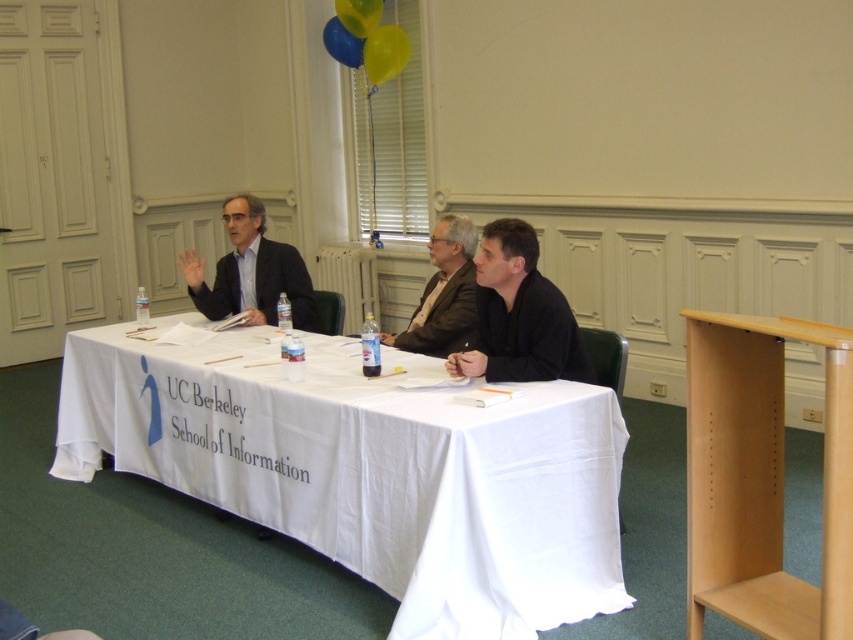
Question: Can you confirm if rubber yellow balloon at upper center is bigger than yellow rubber balloon at upper center?

Choices:
 (A) yes
 (B) no

Answer: (A)

Question: Which of the following is the closest to the observer?

Choices:
 (A) (358, 26)
 (B) (399, 486)

Answer: (B)

Question: Is matte black shirt at center wider than dark brown leather jacket at center?

Choices:
 (A) no
 (B) yes

Answer: (B)

Question: Based on their relative distances, which object is nearer to the yellow rubber balloon at upper center?

Choices:
 (A) white cloth-covered table at center
 (B) dark brown leather jacket at center
 (C) rubber yellow balloon at upper center

Answer: (C)

Question: Can you confirm if white cloth-covered table at center is positioned below matte black shirt at center?

Choices:
 (A) yes
 (B) no

Answer: (A)

Question: Which object appears closest to the camera in this image?

Choices:
 (A) matte black suit at center
 (B) dark brown leather jacket at center
 (C) rubberized blue balloon at upper center
 (D) white cloth-covered table at center

Answer: (D)